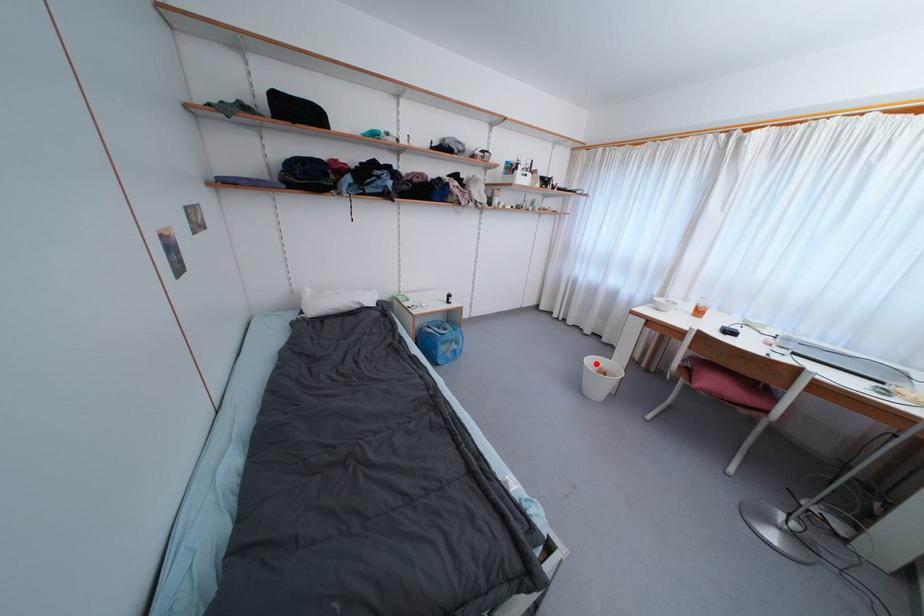
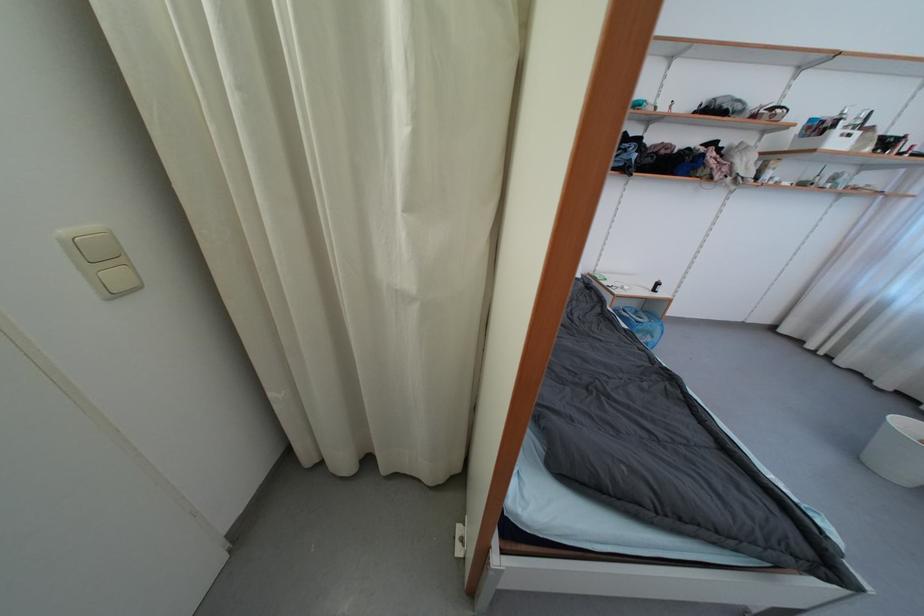
Question: I am providing you with two images of the same scene from different viewpoints. Image1 has a red point marked. In image2, the corresponding 3D location appears at what relative position? Reply with the corresponding letter.

Choices:
 (A) Closer
 (B) Farther

Answer: (B)